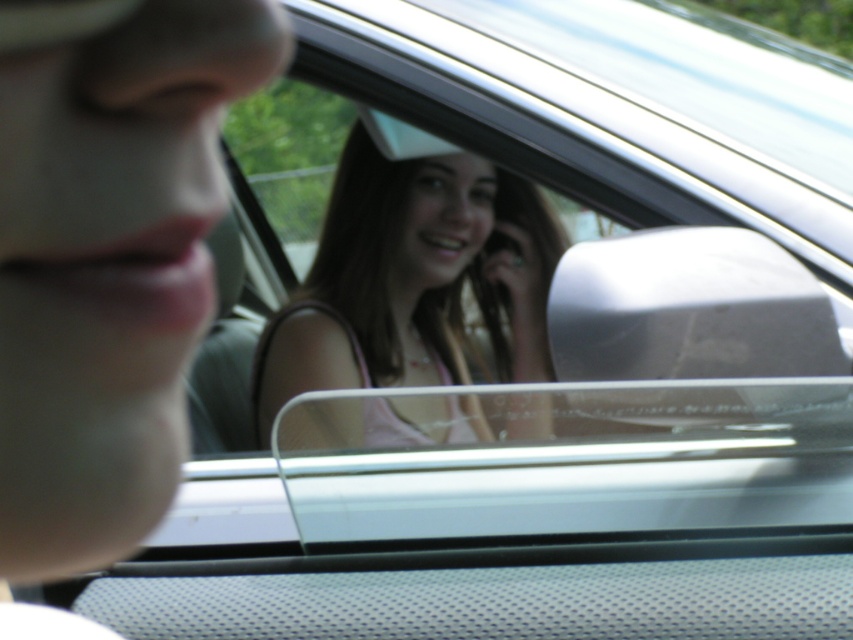
You are a photographer trying to capture the reflection of the person in the car side mirror. You want to ensure that the reflection of the matte skin at left is visible in the photo. Based on the coordinates provided, is the point at (108, 257) within the reflection area of the side mirror?

The point at (108, 257) corresponds to matte skin at left, which is part of the reflection area in the side mirror. Therefore, the reflection of the matte skin at left is visible at that coordinate.

In the scene shown: You are designing a car interior and want to ensure that the matte skin at left and the pink fabric at center are both visible in the side mirror reflection. Which object will appear narrower in the reflection?

The matte skin at left will appear narrower in the reflection because it is thinner than the pink fabric at center.